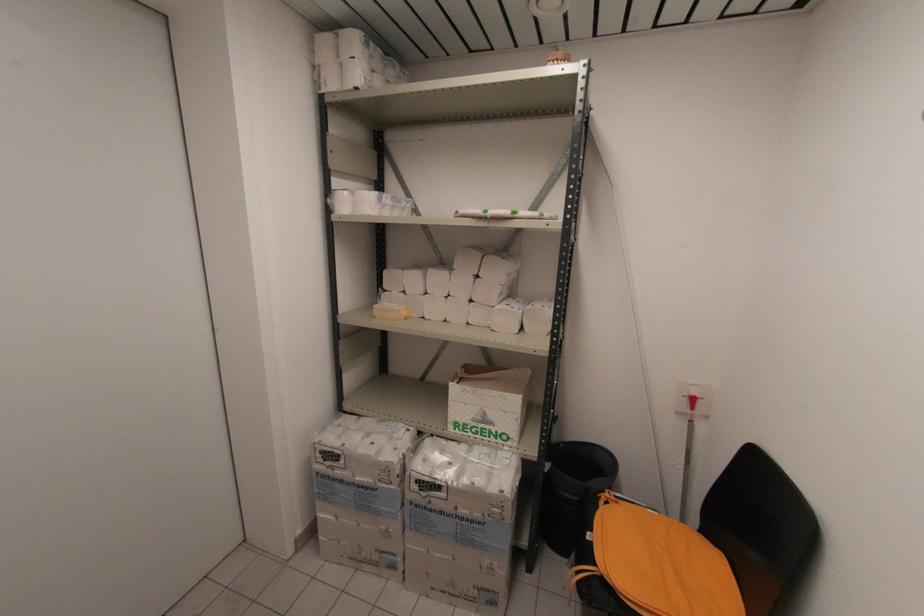
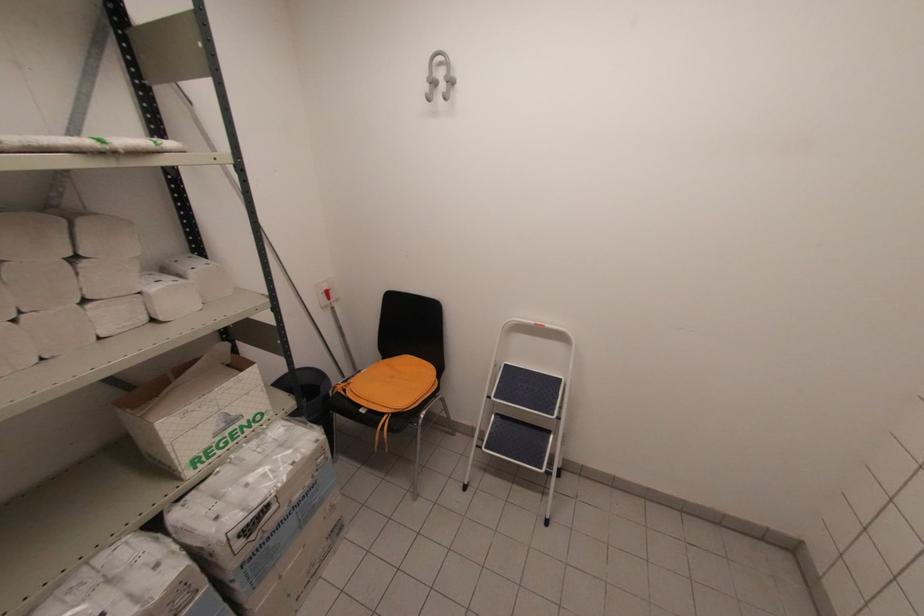
Based on the continuous images, in which direction is the camera rotating?

The camera rotated toward right-down.